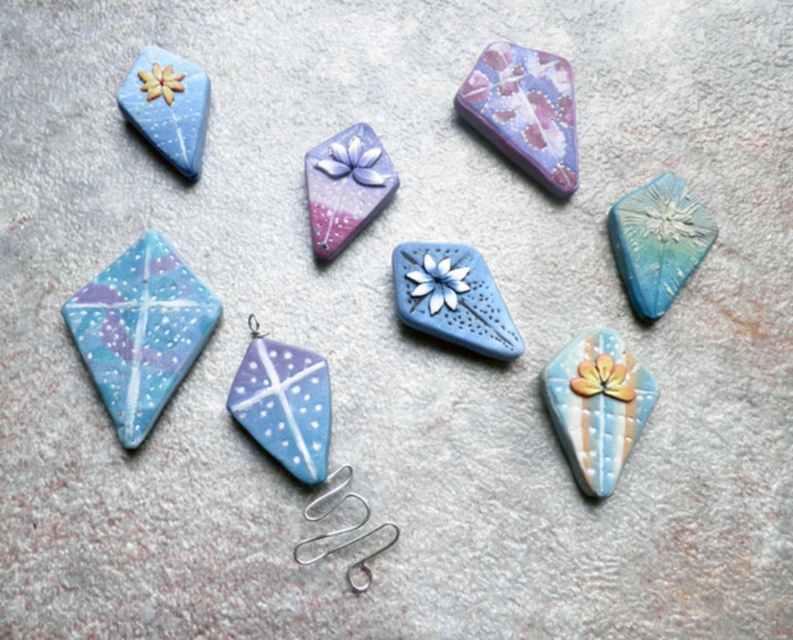
Question: Does matte blue clay flower at center lie behind silver wire at lower center?

Choices:
 (A) no
 (B) yes

Answer: (B)

Question: Which point is farther from the camera taking this photo?

Choices:
 (A) (234, 412)
 (B) (347, 484)

Answer: (B)

Question: Which object is the farthest from the silver wire at lower center?

Choices:
 (A) matte blue clay flower at center
 (B) matte pastel diamond at lower right
 (C) pastel glossy square at upper center

Answer: (C)

Question: Can you confirm if matte blue clay pendant at center is thinner than matte blue clay flower at center?

Choices:
 (A) no
 (B) yes

Answer: (B)

Question: In this image, where is pastel glossy square at upper center located relative to silver wire at lower center?

Choices:
 (A) below
 (B) above

Answer: (B)

Question: Which point appears farthest from the camera in this image?

Choices:
 (A) (366, 556)
 (B) (489, 291)
 (C) (382, 170)
 (D) (462, 83)

Answer: (D)